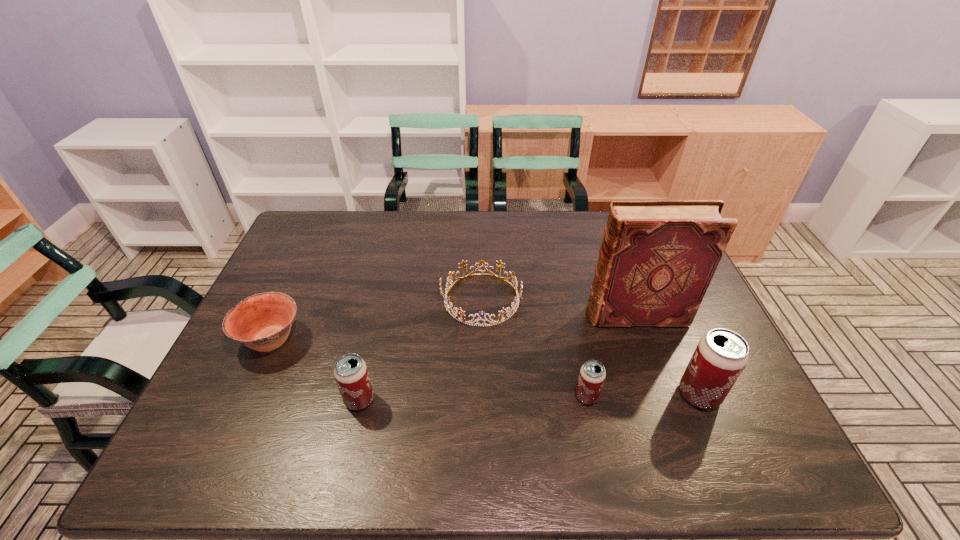
The image size is (960, 540). Find the location of `object that is positioned at the left edge`. object that is positioned at the left edge is located at coordinates (262, 322).

I want to click on beer can that is at the right edge, so click(721, 355).

Where is `hardback book located at the right edge`? This screenshot has height=540, width=960. hardback book located at the right edge is located at coordinates (658, 257).

This screenshot has height=540, width=960. Find the location of `object at the near right corner`. object at the near right corner is located at coordinates (721, 355).

The image size is (960, 540). In the image, there is a desktop. What are the coordinates of `blank space at the far edge` in the screenshot? It's located at (540, 234).

Where is `vacant position at the near edge of the desktop`? vacant position at the near edge of the desktop is located at coordinates (506, 405).

What are the coordinates of `vacant space at the far left corner of the desktop` in the screenshot? It's located at (331, 212).

Find the location of a particular element. This screenshot has height=540, width=960. free space at the near right corner of the desktop is located at coordinates (756, 417).

At what (x,y) coordinates should I click in order to perform the action: click on free space between the third object from right to left and the fourth object from right to left. Please return your answer as a coordinate pair (x, y). Image resolution: width=960 pixels, height=540 pixels. Looking at the image, I should click on (534, 348).

Locate an element on the screen. free space between the second beer can from left to right and the shortest object is located at coordinates (534, 348).